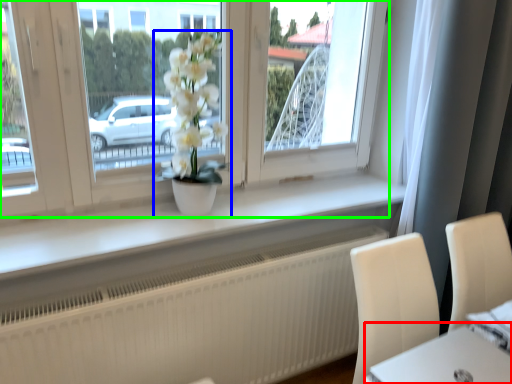
Question: Considering the real-world distances, which object is closest to round table (highlighted by a red box)? houseplant (highlighted by a blue box) or window (highlighted by a green box).

Choices:
 (A) houseplant
 (B) window

Answer: (A)